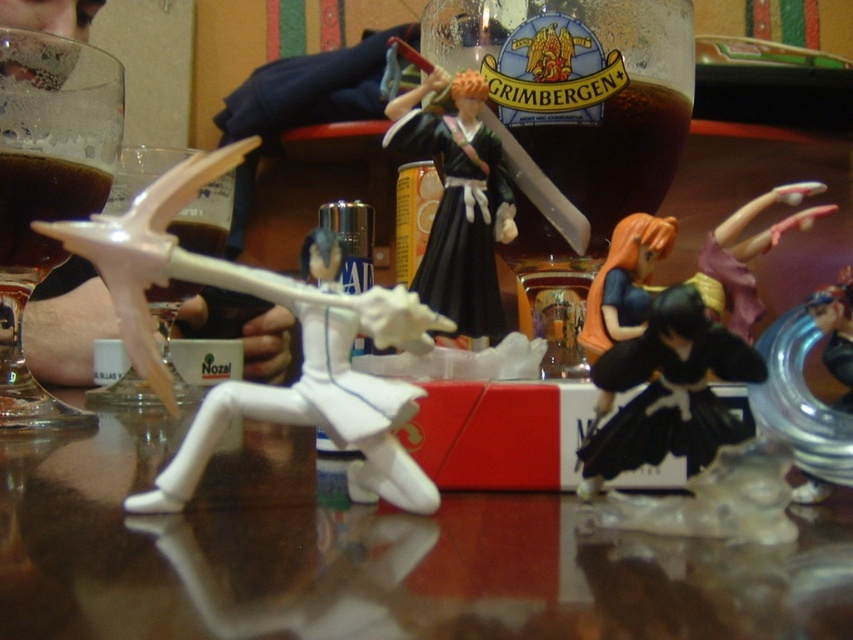
Question: Can you confirm if white plastic wine glass at left is positioned above brown liquid at left?

Choices:
 (A) no
 (B) yes

Answer: (A)

Question: Which of the following is the farthest from the observer?

Choices:
 (A) glossy brown table at center
 (B) transparent glass at left
 (C) white plastic toy at center
 (D) matte pink hair at upper right

Answer: (B)

Question: Which object is farther from the camera taking this photo?

Choices:
 (A) black matte dress at center
 (B) matte pink hair at upper right
 (C) glossy brown table at center
 (D) white plastic wine glass at left

Answer: (D)

Question: Does transparent glass at left appear on the left side of matte pink hair at upper right?

Choices:
 (A) yes
 (B) no

Answer: (A)

Question: Is white plastic toy at center closer to camera compared to matte pink hair at upper right?

Choices:
 (A) yes
 (B) no

Answer: (A)

Question: Estimate the real-world distances between objects in this image. Which object is farther from the black matte figure at center?

Choices:
 (A) brown liquid at left
 (B) white plastic wine glass at left
 (C) matte pink hair at upper right
 (D) white plastic spoon at upper left

Answer: (D)